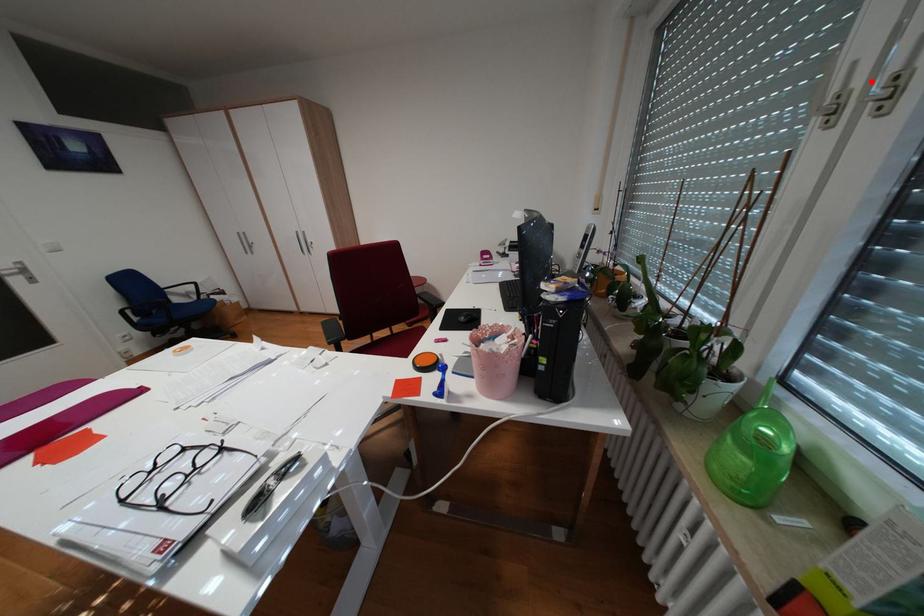
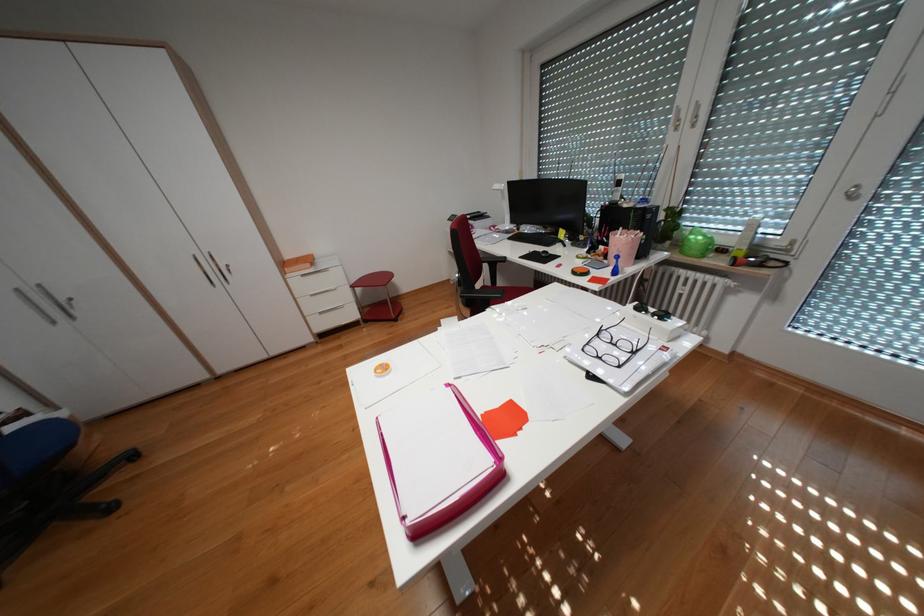
Question: I am providing you with two images of the same scene from different viewpoints. A red point is shown in image1. For the corresponding object point in image2, is it positioned nearer or farther from the camera?

Choices:
 (A) Nearer
 (B) Farther

Answer: (A)